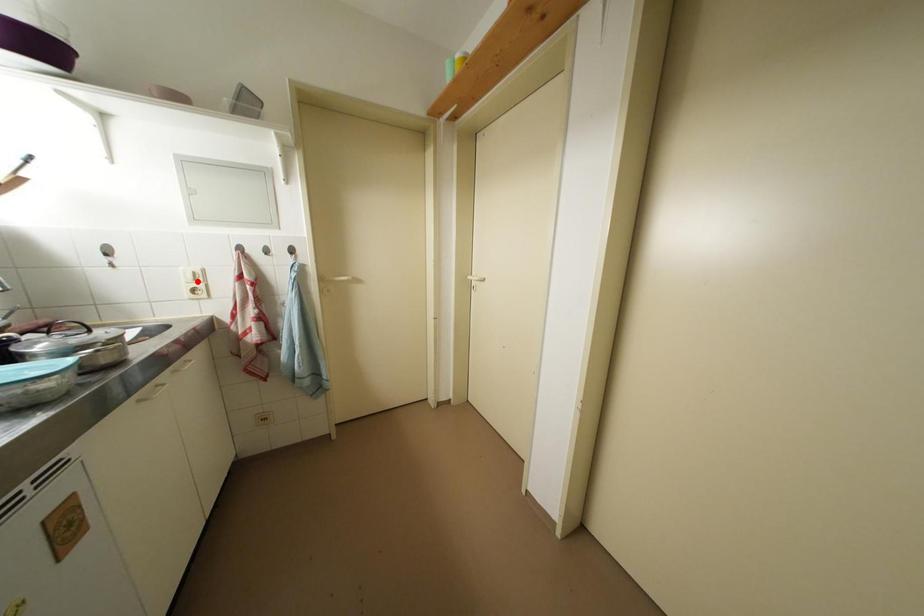
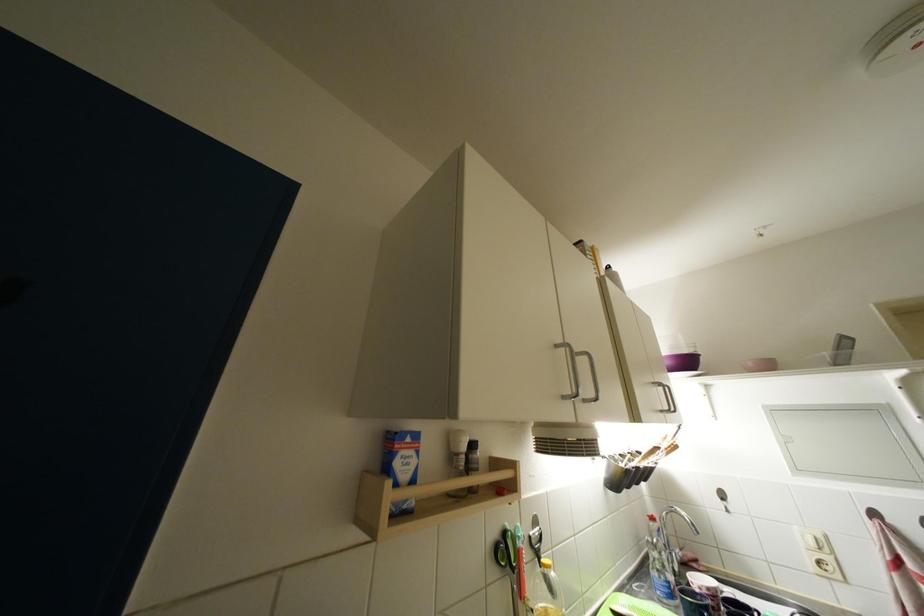
Question: I am providing you with two images of the same scene from different viewpoints. In image1, a red point is highlighted. Considering the same 3D point in image2, which of the following is correct?

Choices:
 (A) It is closer
 (B) It is farther

Answer: (A)